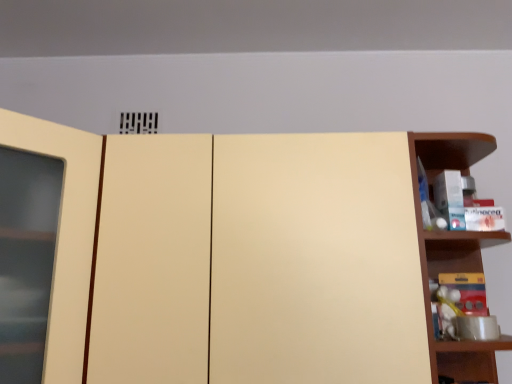
Question: Are matte yellow toy at right and wooden shelf at right far apart?

Choices:
 (A) yes
 (B) no

Answer: (B)

Question: From a real-world perspective, is matte yellow toy at right physically above wooden shelf at right?

Choices:
 (A) no
 (B) yes

Answer: (A)

Question: Is matte yellow toy at right positioned in front of wooden shelf at right?

Choices:
 (A) yes
 (B) no

Answer: (B)

Question: Is matte yellow toy at right looking in the opposite direction of wooden shelf at right?

Choices:
 (A) yes
 (B) no

Answer: (A)

Question: Does matte yellow toy at right have a greater height compared to wooden shelf at right?

Choices:
 (A) yes
 (B) no

Answer: (B)

Question: Is matte yellow toy at right aimed at wooden shelf at right?

Choices:
 (A) no
 (B) yes

Answer: (B)

Question: Can you confirm if matte cream cupboard at center is thinner than wooden shelf at right?

Choices:
 (A) no
 (B) yes

Answer: (A)

Question: Are matte cream cupboard at center and wooden shelf at right far apart?

Choices:
 (A) no
 (B) yes

Answer: (A)

Question: Is matte cream cupboard at center shorter than wooden shelf at right?

Choices:
 (A) yes
 (B) no

Answer: (B)

Question: Does matte cream cupboard at center contain wooden shelf at right?

Choices:
 (A) no
 (B) yes

Answer: (A)

Question: Is matte cream cupboard at center turned away from wooden shelf at right?

Choices:
 (A) no
 (B) yes

Answer: (A)

Question: From the image's perspective, is matte cream cupboard at center under wooden shelf at right?

Choices:
 (A) no
 (B) yes

Answer: (A)

Question: Would you say matte cream cupboard at center is outside matte yellow toy at right?

Choices:
 (A) yes
 (B) no

Answer: (A)